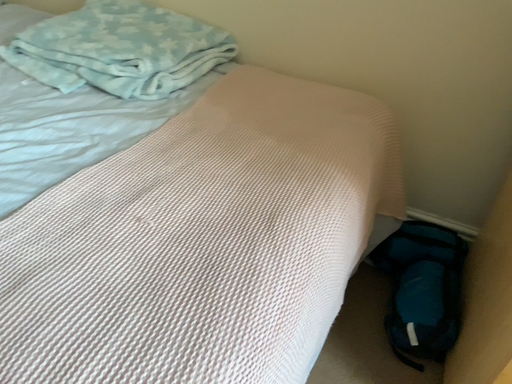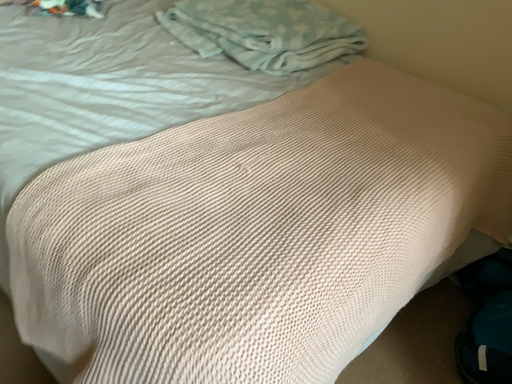
Question: Which way did the camera rotate in the video?

Choices:
 (A) rotated right
 (B) rotated left

Answer: (B)